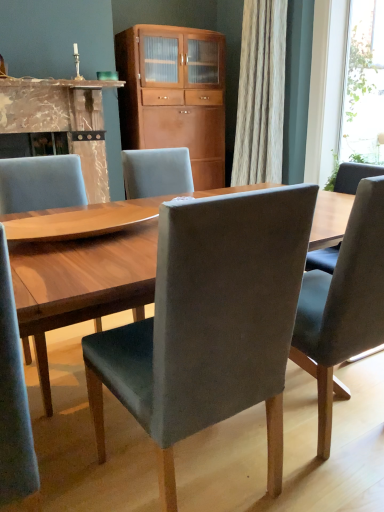
Question: Is velvet grey chair at center, which is the 2th chair from left to right, to the left of wooden cabinet at center from the viewer's perspective?

Choices:
 (A) yes
 (B) no

Answer: (B)

Question: Considering the relative sizes of velvet grey chair at center, which is the 2th chair from left to right, and wooden cabinet at center in the image provided, is velvet grey chair at center, which is the 2th chair from left to right, shorter than wooden cabinet at center?

Choices:
 (A) no
 (B) yes

Answer: (B)

Question: From a real-world perspective, is velvet grey chair at center, which is the 2th chair from left to right, on top of wooden cabinet at center?

Choices:
 (A) yes
 (B) no

Answer: (B)

Question: Can you confirm if velvet grey chair at center, placed as the 2th chair when sorted from right to left, is smaller than wooden cabinet at center?

Choices:
 (A) no
 (B) yes

Answer: (B)

Question: Are velvet grey chair at center, placed as the 2th chair when sorted from right to left, and wooden cabinet at center beside each other?

Choices:
 (A) yes
 (B) no

Answer: (B)

Question: In the image, is transparent glass window at upper right positioned in front of or behind wooden cabinet at center?

Choices:
 (A) front
 (B) behind

Answer: (A)

Question: In terms of width, does transparent glass window at upper right look wider or thinner when compared to wooden cabinet at center?

Choices:
 (A) wide
 (B) thin

Answer: (B)

Question: Looking at the image, does transparent glass window at upper right seem bigger or smaller compared to wooden cabinet at center?

Choices:
 (A) big
 (B) small

Answer: (B)

Question: Considering the relative positions of transparent glass window at upper right and wooden cabinet at center in the image provided, is transparent glass window at upper right to the left or to the right of wooden cabinet at center?

Choices:
 (A) left
 (B) right

Answer: (B)

Question: In the image, is wooden cabinet at center positioned in front of or behind velvet grey chair at center, marked as the 3th chair in a left-to-right arrangement?

Choices:
 (A) front
 (B) behind

Answer: (B)

Question: From their relative heights in the image, would you say wooden cabinet at center is taller or shorter than velvet grey chair at center, marked as the 3th chair in a left-to-right arrangement?

Choices:
 (A) short
 (B) tall

Answer: (B)

Question: From the image's perspective, is wooden cabinet at center located above or below velvet grey chair at center, marked as the 3th chair in a left-to-right arrangement?

Choices:
 (A) below
 (B) above

Answer: (B)

Question: In terms of width, does wooden cabinet at center look wider or thinner when compared to velvet grey chair at center, marked as the 3th chair in a left-to-right arrangement?

Choices:
 (A) wide
 (B) thin

Answer: (B)

Question: From a real-world perspective, relative to marble fireplace at left, is transparent glass window at upper right vertically above or below?

Choices:
 (A) below
 (B) above

Answer: (B)

Question: Choose the correct answer: Is transparent glass window at upper right inside marble fireplace at left or outside it?

Choices:
 (A) outside
 (B) inside

Answer: (A)